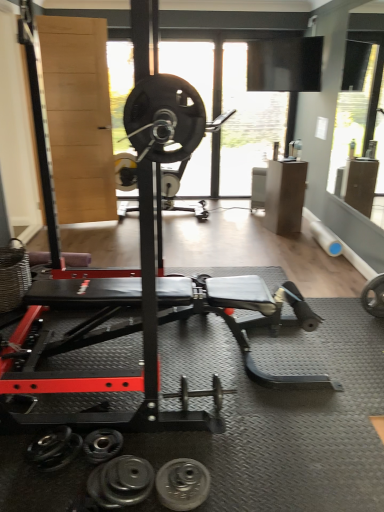
Question: From a real-world perspective, does silver metallic dumbbell at center, which appears as the third dumbbell when viewed from the left, sit lower than transparent glass window screen at upper center?

Choices:
 (A) no
 (B) yes

Answer: (B)

Question: Is silver metallic dumbbell at center, which is the first dumbbell in right-to-left order, surrounding transparent glass window screen at upper center?

Choices:
 (A) yes
 (B) no

Answer: (B)

Question: From the image's perspective, is silver metallic dumbbell at center, the 3th dumbbell when ordered from bottom to top, located above transparent glass window screen at upper center?

Choices:
 (A) no
 (B) yes

Answer: (A)

Question: Can you confirm if silver metallic dumbbell at center, the 3th dumbbell when ordered from bottom to top, is wider than transparent glass window screen at upper center?

Choices:
 (A) no
 (B) yes

Answer: (B)

Question: From the image's perspective, would you say silver metallic dumbbell at center, which appears as the third dumbbell when viewed from the left, is shown under transparent glass window screen at upper center?

Choices:
 (A) no
 (B) yes

Answer: (B)

Question: Can you confirm if silver metallic dumbbell at center, the third dumbbell in the front-to-back sequence, is positioned to the left of transparent glass window screen at upper center?

Choices:
 (A) no
 (B) yes

Answer: (B)

Question: Is black rubber weight plate at lower center facing towards black rubber dumbbell at lower center, the 2th dumbbell in the top-to-bottom sequence?

Choices:
 (A) no
 (B) yes

Answer: (A)

Question: From a real-world perspective, is black rubber weight plate at lower center over black rubber dumbbell at lower center, the 2th dumbbell from the bottom?

Choices:
 (A) no
 (B) yes

Answer: (B)

Question: Does black rubber weight plate at lower center appear on the right side of black rubber dumbbell at lower center, which is counted as the 3th dumbbell, starting from the right?

Choices:
 (A) yes
 (B) no

Answer: (A)

Question: Considering the relative positions of black rubber weight plate at lower center and black rubber dumbbell at lower center, which is counted as the 3th dumbbell, starting from the right, in the image provided, is black rubber weight plate at lower center to the left of black rubber dumbbell at lower center, which is counted as the 3th dumbbell, starting from the right, from the viewer's perspective?

Choices:
 (A) no
 (B) yes

Answer: (A)

Question: Is black rubber weight plate at lower center positioned beyond the bounds of black rubber dumbbell at lower center, which is the second dumbbell in back-to-front order?

Choices:
 (A) yes
 (B) no

Answer: (A)

Question: From the image's perspective, is black rubber weight plate at lower center above black rubber dumbbell at lower center, the 2th dumbbell from the bottom?

Choices:
 (A) yes
 (B) no

Answer: (B)

Question: From a real-world perspective, does transparent glass window screen at upper center stand above black rubber dumbbell at lower center, which is the third dumbbell from back to front?

Choices:
 (A) yes
 (B) no

Answer: (A)